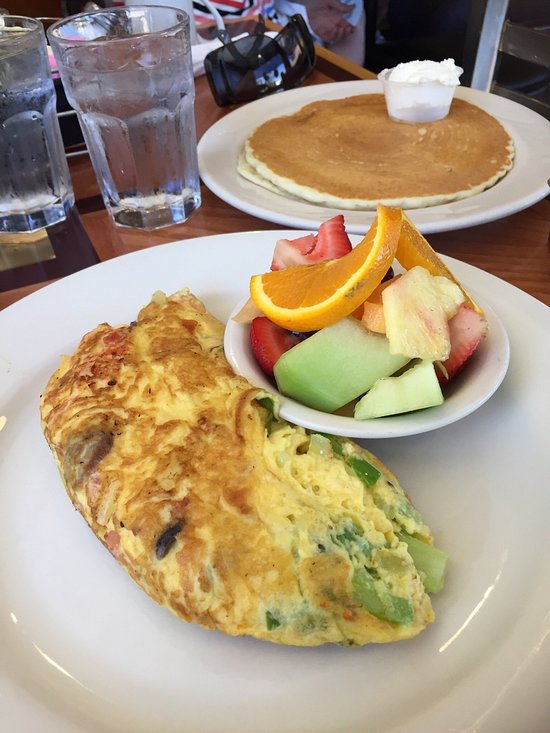
Locate an element on the screen. Image resolution: width=550 pixels, height=733 pixels. glasses of water is located at coordinates [x=133, y=136], [x=25, y=171].